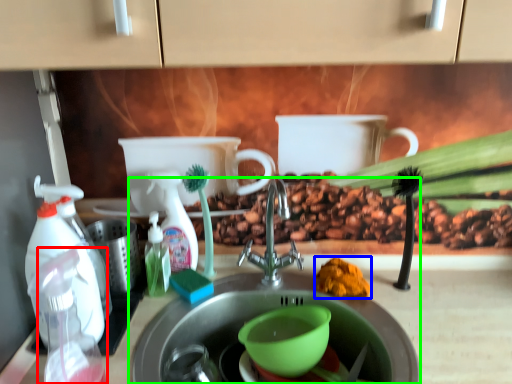
Question: Which is farther away from bottle (highlighted by a red box)? debris (highlighted by a blue box) or sink (highlighted by a green box)?

Choices:
 (A) debris
 (B) sink

Answer: (A)